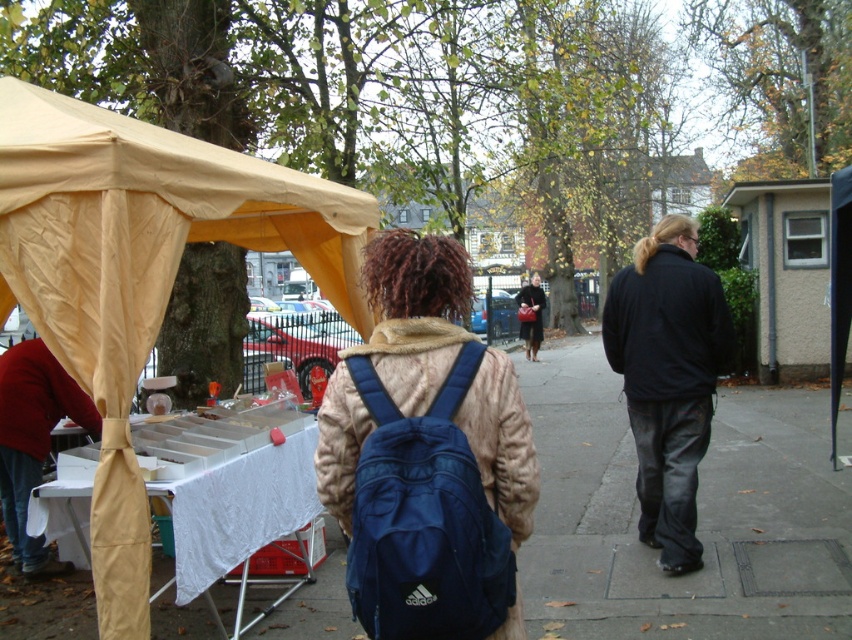
Which is above, matte blue backpack at center or navy blue fabric backpack at center?

navy blue fabric backpack at center is above.

Is matte blue backpack at center below navy blue fabric backpack at center?

Indeed, matte blue backpack at center is positioned under navy blue fabric backpack at center.

Is point (766, 468) in front of point (467, 486)?

No, it is not.

The width and height of the screenshot is (852, 640). Identify the location of matte blue backpack at center. point(698,516).

Is matte blue backpack at center thinner than beige fabric tent at left?

No.

Which is above, matte blue backpack at center or beige fabric tent at left?

beige fabric tent at left is higher up.

The width and height of the screenshot is (852, 640). In order to click on matte blue backpack at center in this screenshot , I will do `click(698, 516)`.

Between navy blue fabric backpack at center and black leather jacket at right, which one has more height?

Standing taller between the two is black leather jacket at right.

Does navy blue fabric backpack at center come in front of black leather jacket at right?

Yes, navy blue fabric backpack at center is in front of black leather jacket at right.

Does point (456, 396) come behind point (666, 372)?

No, (456, 396) is in front of (666, 372).

What are the coordinates of `navy blue fabric backpack at center` in the screenshot? It's located at (424, 518).